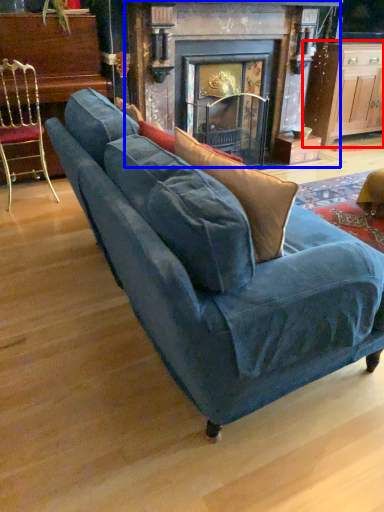
Question: Among these objects, which one is nearest to the camera, table (highlighted by a red box) or fireplace (highlighted by a blue box)?

Choices:
 (A) table
 (B) fireplace

Answer: (B)